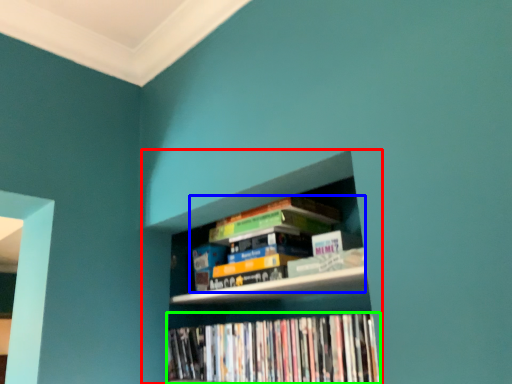
Question: Which object is positioned farthest from bookcase (highlighted by a red box)? Select from book (highlighted by a blue box) and book (highlighted by a green box).

Choices:
 (A) book
 (B) book

Answer: (A)